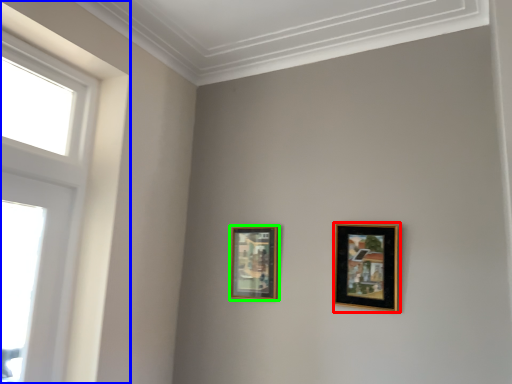
Question: Which object is the closest to the picture frame (highlighted by a red box)? Choose among these: window (highlighted by a blue box) or picture frame (highlighted by a green box).

Choices:
 (A) window
 (B) picture frame

Answer: (B)